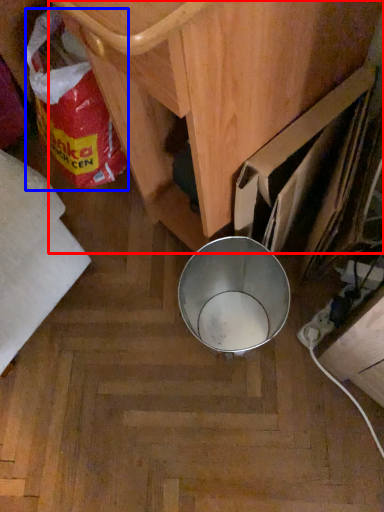
Question: Which object appears farthest to the camera in this image, furniture (highlighted by a red box) or waste (highlighted by a blue box)?

Choices:
 (A) furniture
 (B) waste

Answer: (B)